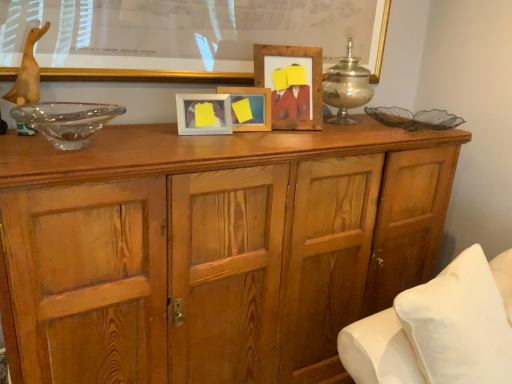
Question: From a real-world perspective, is silver metallic candle holder at upper center positioned under transparent glass bowl at left based on gravity?

Choices:
 (A) no
 (B) yes

Answer: (A)

Question: Is silver metallic candle holder at upper center at the left side of transparent glass bowl at left?

Choices:
 (A) yes
 (B) no

Answer: (B)

Question: Is silver metallic candle holder at upper center aimed at transparent glass bowl at left?

Choices:
 (A) no
 (B) yes

Answer: (A)

Question: Can you confirm if silver metallic candle holder at upper center is smaller than transparent glass bowl at left?

Choices:
 (A) no
 (B) yes

Answer: (A)

Question: Does silver metallic candle holder at upper center have a larger size compared to transparent glass bowl at left?

Choices:
 (A) yes
 (B) no

Answer: (A)

Question: Is transparent glass bowl at left spatially inside wooden cabinet at center, or outside of it?

Choices:
 (A) inside
 (B) outside

Answer: (B)

Question: Visually, is transparent glass bowl at left positioned to the left or to the right of wooden cabinet at center?

Choices:
 (A) right
 (B) left

Answer: (B)

Question: Is transparent glass bowl at left in front of or behind wooden cabinet at center in the image?

Choices:
 (A) behind
 (B) front

Answer: (A)

Question: Considering the positions of transparent glass bowl at left and wooden cabinet at center in the image, is transparent glass bowl at left taller or shorter than wooden cabinet at center?

Choices:
 (A) tall
 (B) short

Answer: (B)

Question: Choose the correct answer: Is wooden frame at upper center inside matte wooden picture frame at center, the third picture frame positioned from the right, or outside it?

Choices:
 (A) inside
 (B) outside

Answer: (B)

Question: From the image's perspective, is wooden frame at upper center positioned above or below matte wooden picture frame at center, the third picture frame positioned from the right?

Choices:
 (A) above
 (B) below

Answer: (A)

Question: From a real-world perspective, is wooden frame at upper center physically located above or below matte wooden picture frame at center, acting as the first picture frame starting from the left?

Choices:
 (A) below
 (B) above

Answer: (B)

Question: In terms of height, does wooden frame at upper center look taller or shorter compared to matte wooden picture frame at center, the third picture frame positioned from the right?

Choices:
 (A) tall
 (B) short

Answer: (A)

Question: Relative to wooden photo frame at center, which is the second picture frame in right-to-left order, is white soft pillow at lower right in front or behind?

Choices:
 (A) front
 (B) behind

Answer: (A)

Question: From the image's perspective, is white soft pillow at lower right positioned above or below wooden photo frame at center, which is the second picture frame in right-to-left order?

Choices:
 (A) below
 (B) above

Answer: (A)